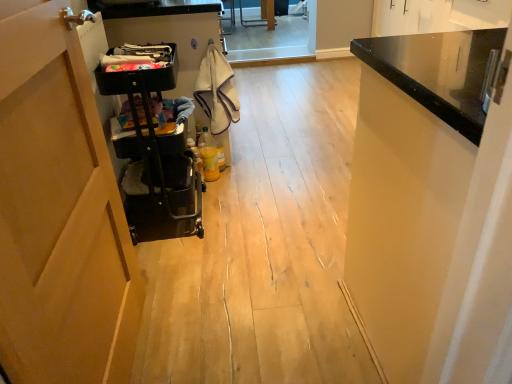
Where is `free space to the left of black glossy cabinet at upper right`? free space to the left of black glossy cabinet at upper right is located at coordinates (264, 316).